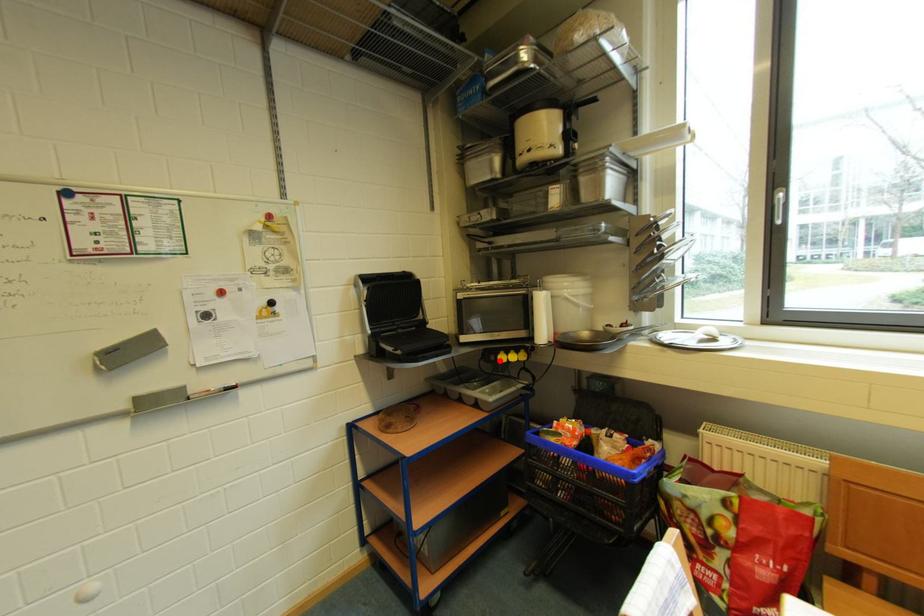
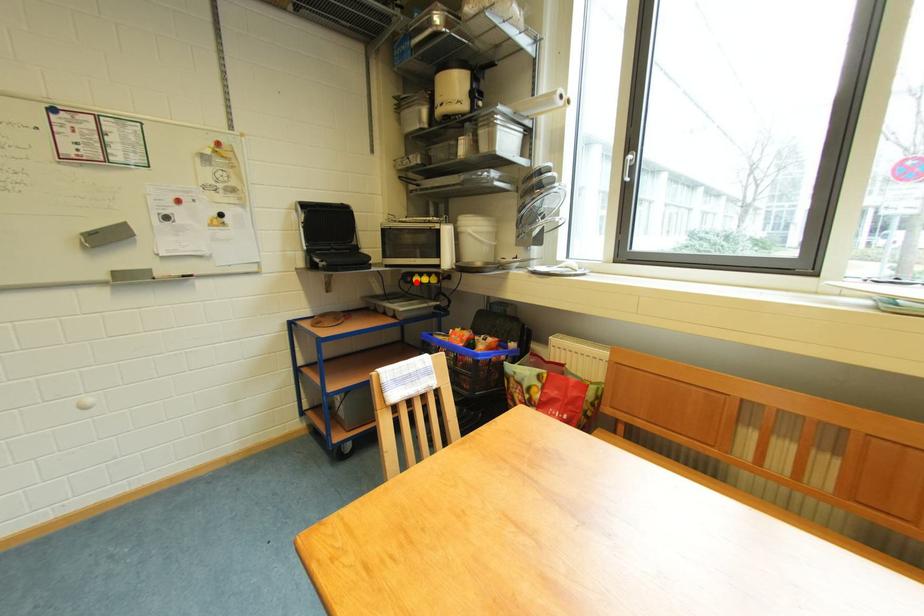
I am providing you with two images of the same scene from different viewpoints. A red point is marked on the first image and another point is marked on the second image. Are the points marked in image1 and image2 representing the same 3D position?

Yes